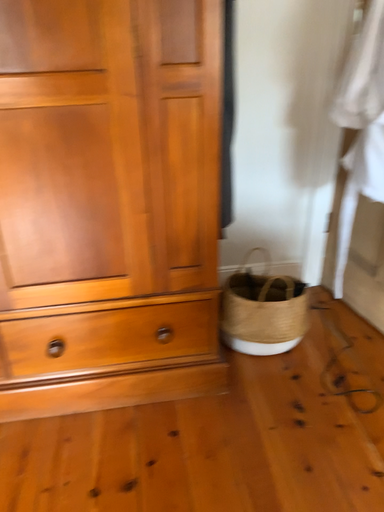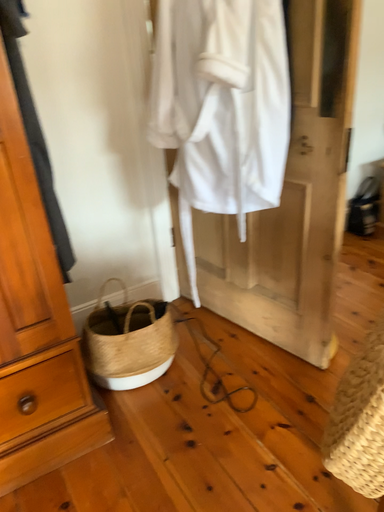
Question: How did the camera likely rotate when shooting the video?

Choices:
 (A) rotated right
 (B) rotated left

Answer: (A)